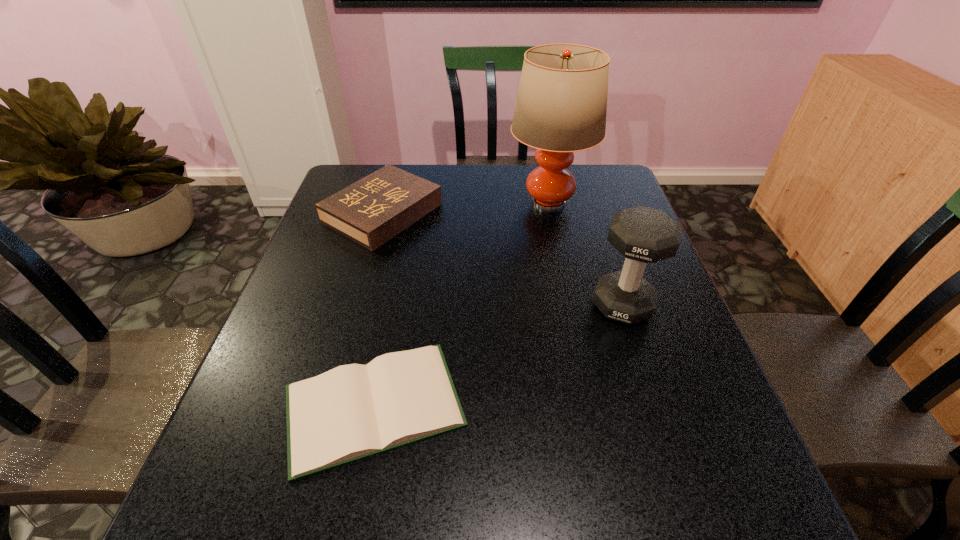
Locate an element on the screen. lamp is located at coordinates (561, 105).

This screenshot has width=960, height=540. I want to click on the third shortest object, so click(643, 235).

Image resolution: width=960 pixels, height=540 pixels. I want to click on dumbbell, so click(x=643, y=235).

This screenshot has height=540, width=960. Identify the location of the taller hardback book. (371, 211).

The image size is (960, 540). Identify the location of the farther hardback book. (371, 211).

Image resolution: width=960 pixels, height=540 pixels. What are the coordinates of `the shortest object` in the screenshot? It's located at (352, 412).

At what (x,y) coordinates should I click in order to perform the action: click on the nearer hardback book. Please return your answer as a coordinate pair (x, y). The width and height of the screenshot is (960, 540). Looking at the image, I should click on (352, 412).

Find the location of a particular element. Image resolution: width=960 pixels, height=540 pixels. free space located 0.160m on the left of the lamp is located at coordinates (454, 204).

At what (x,y) coordinates should I click in order to perform the action: click on blank area located on the back of the third farthest object. Please return your answer as a coordinate pair (x, y). The image size is (960, 540). Looking at the image, I should click on (609, 262).

Image resolution: width=960 pixels, height=540 pixels. I want to click on free region located on the right of the taller hardback book, so click(x=526, y=213).